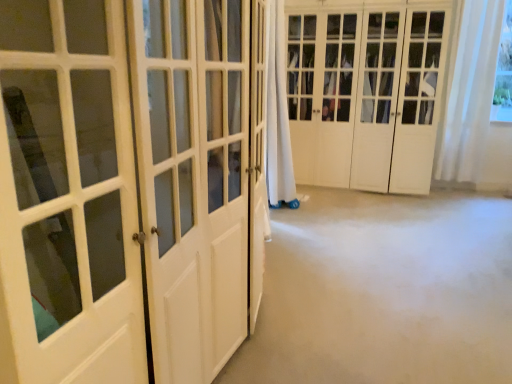
Question: Can you confirm if white sheer curtain at upper right is shorter than white wood closet doors at center, the 2th door in the front-to-back sequence?

Choices:
 (A) no
 (B) yes

Answer: (B)

Question: From a real-world perspective, is white sheer curtain at upper right on top of white wood closet doors at center, the first door positioned from the back?

Choices:
 (A) no
 (B) yes

Answer: (B)

Question: Considering the relative sizes of white sheer curtain at upper right and white wood closet doors at center, the first door positioned from the back, in the image provided, is white sheer curtain at upper right taller than white wood closet doors at center, the first door positioned from the back,?

Choices:
 (A) no
 (B) yes

Answer: (A)

Question: Can you confirm if white sheer curtain at upper right is thinner than white wood closet doors at center, the 2th door in the front-to-back sequence?

Choices:
 (A) yes
 (B) no

Answer: (A)

Question: Would you say white sheer curtain at upper right is outside white wood closet doors at center, the 2th door in the front-to-back sequence?

Choices:
 (A) yes
 (B) no

Answer: (A)

Question: Considering the positions of white glossy door at left, arranged as the first door when viewed from the front, and white wood closet doors at center, the first door positioned from the right, in the image, is white glossy door at left, arranged as the first door when viewed from the front, bigger or smaller than white wood closet doors at center, the first door positioned from the right,?

Choices:
 (A) small
 (B) big

Answer: (A)

Question: From the image's perspective, is white glossy door at left, the 2th door when ordered from right to left, positioned above or below white wood closet doors at center, the first door positioned from the right?

Choices:
 (A) above
 (B) below

Answer: (B)

Question: Would you say white glossy door at left, the 2th door when ordered from right to left, is inside or outside white wood closet doors at center, the first door positioned from the back?

Choices:
 (A) inside
 (B) outside

Answer: (B)

Question: Is white glossy door at left, the 1th door when ordered from left to right, to the left or to the right of white wood closet doors at center, which appears as the second door when viewed from the left, in the image?

Choices:
 (A) left
 (B) right

Answer: (A)

Question: In the image, is white glossy door at left, arranged as the first door when viewed from the front, positioned in front of or behind white sheer curtain at upper right?

Choices:
 (A) front
 (B) behind

Answer: (A)

Question: From the image's perspective, relative to white sheer curtain at upper right, is white glossy door at left, which appears as the 2th door when viewed from the back, above or below?

Choices:
 (A) below
 (B) above

Answer: (A)

Question: Considering the positions of white glossy door at left, the 1th door when ordered from left to right, and white sheer curtain at upper right in the image, is white glossy door at left, the 1th door when ordered from left to right, wider or thinner than white sheer curtain at upper right?

Choices:
 (A) wide
 (B) thin

Answer: (A)

Question: Considering the relative positions of white glossy door at left, which appears as the 2th door when viewed from the back, and white sheer curtain at upper right in the image provided, is white glossy door at left, which appears as the 2th door when viewed from the back, to the left or to the right of white sheer curtain at upper right?

Choices:
 (A) left
 (B) right

Answer: (A)

Question: Considering their positions, is white wood closet doors at center, the first door positioned from the back, located in front of or behind white glossy door at left, the 2th door when ordered from right to left?

Choices:
 (A) front
 (B) behind

Answer: (B)

Question: Is point (359, 91) positioned closer to the camera than point (252, 241)?

Choices:
 (A) farther
 (B) closer

Answer: (A)